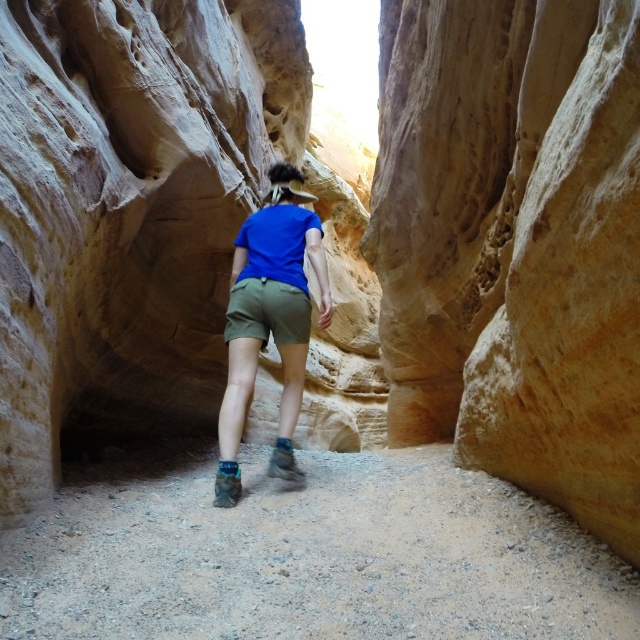
Between dusty gravel trail at center and blue fabric shirt at center, which one appears on the right side from the viewer's perspective?

From the viewer's perspective, dusty gravel trail at center appears more on the right side.

Who is more distant from viewer, (248,548) or (301,332)?

Point (301,332)

Between point (129, 524) and point (282, 317), which one is positioned behind?

The point (282, 317) is behind.

This screenshot has height=640, width=640. I want to click on dusty gravel trail at center, so click(307, 554).

Which is above, blue fabric shirt at center or khaki cotton shorts at center?

Positioned higher is khaki cotton shorts at center.

Is blue fabric shirt at center positioned in front of khaki cotton shorts at center?

Yes, blue fabric shirt at center is closer to the viewer.

This screenshot has height=640, width=640. What do you see at coordinates (269, 320) in the screenshot?
I see `blue fabric shirt at center` at bounding box center [269, 320].

Where is `blue fabric shirt at center`? This screenshot has height=640, width=640. blue fabric shirt at center is located at coordinates (269, 320).

Between dusty gravel trail at center and khaki cotton shorts at center, which one has less height?

With less height is khaki cotton shorts at center.

Who is positioned more to the left, dusty gravel trail at center or khaki cotton shorts at center?

khaki cotton shorts at center

Where is `dusty gravel trail at center`? The image size is (640, 640). dusty gravel trail at center is located at coordinates (307, 554).